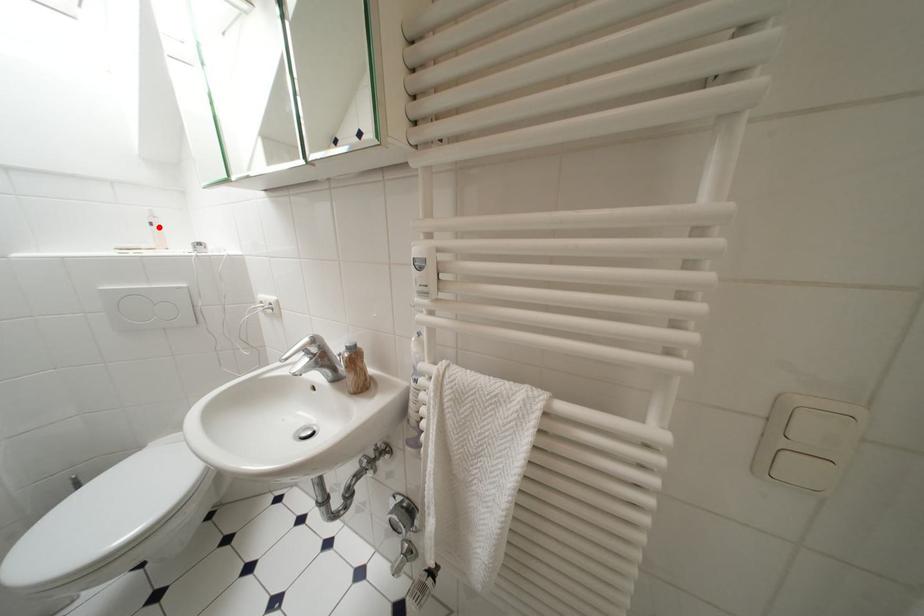
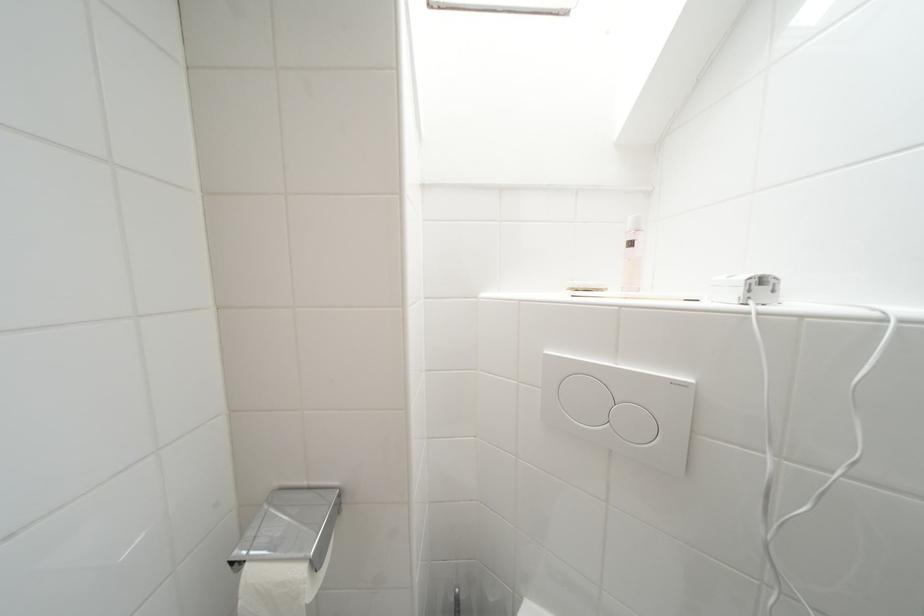
The point at the highlighted location is marked in the first image. Where is the corresponding point in the second image?

(638, 246)